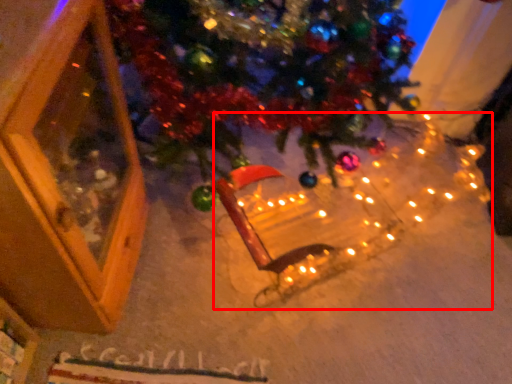
Question: Considering the relative positions of christmas light (annotated by the red box) and screen door in the image provided, where is christmas light (annotated by the red box) located with respect to the staircase?

Choices:
 (A) right
 (B) left

Answer: (A)